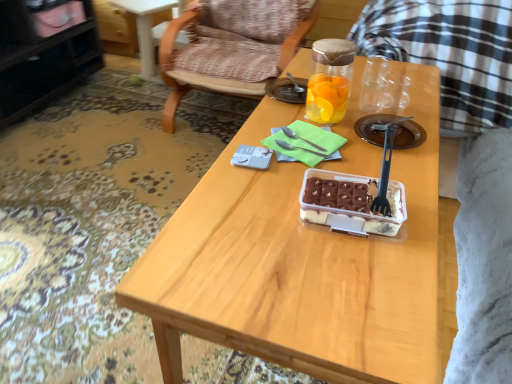
Where is `blank space to the left of satin silver fork at center, the second fork in the front-to-back sequence`? The height and width of the screenshot is (384, 512). blank space to the left of satin silver fork at center, the second fork in the front-to-back sequence is located at coordinates (251, 151).